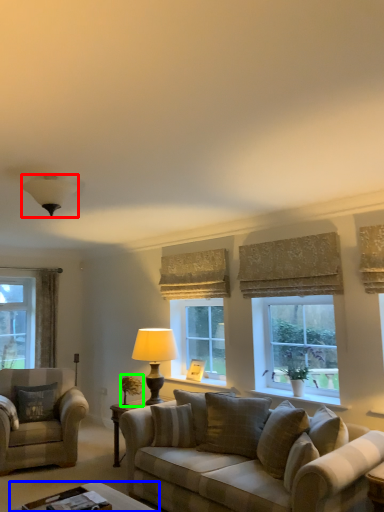
Question: Estimate the real-world distances between objects in this image. Which object is farther from lamp (highlighted by a red box), table (highlighted by a blue box) or houseplant (highlighted by a green box)?

Choices:
 (A) table
 (B) houseplant

Answer: (B)